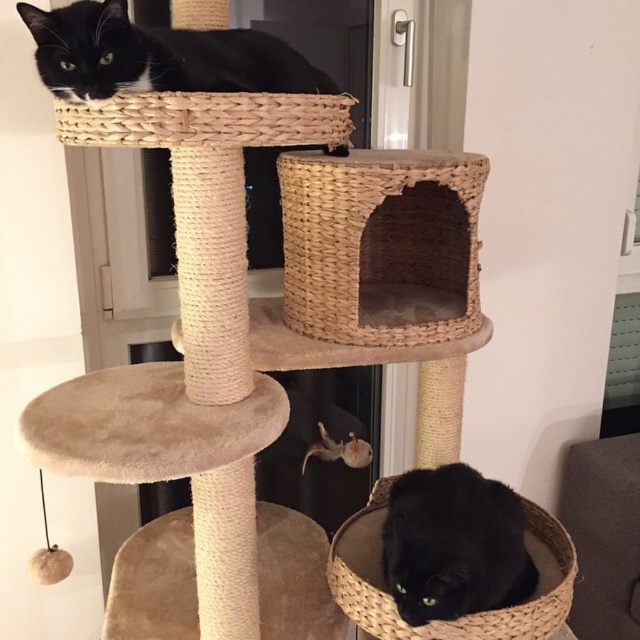
You are a cat owner who wants to place a new cat treat dispenser on the cat tree. The dispenser requires a flat surface that is at least 0.3 meters in width. You see the point marked at coordinates point (x=157, y=54). Is this point suitable for placing the dispenser?

The point marked at coordinates point (x=157, y=54) is the location of the black matte cat at upper center. Since the dispenser requires a flat surface at least 0.3 meters wide, and the cat is occupying that spot, it is not suitable for placing the dispenser.

You are a cat owner who wants to place a new toy in the woven beige basket at center. However, you also have a cat that prefers the woven straw basket at upper center. Which basket is positioned to the right of the other?

The woven beige basket at center is to the right of the woven straw basket at upper center.

You are a cat owner who wants to place a new cat toy on the beige plush stool at center so your cat can reach it easily. Considering the black matte cat at lower center is currently resting there, where should you place the toy to ensure it is visible to the cat without disturbing its resting spot?

The beige plush stool at center is in front of the black matte cat at lower center, so placing the toy on the stool would make it visible to the cat while keeping the resting spot undisturbed.